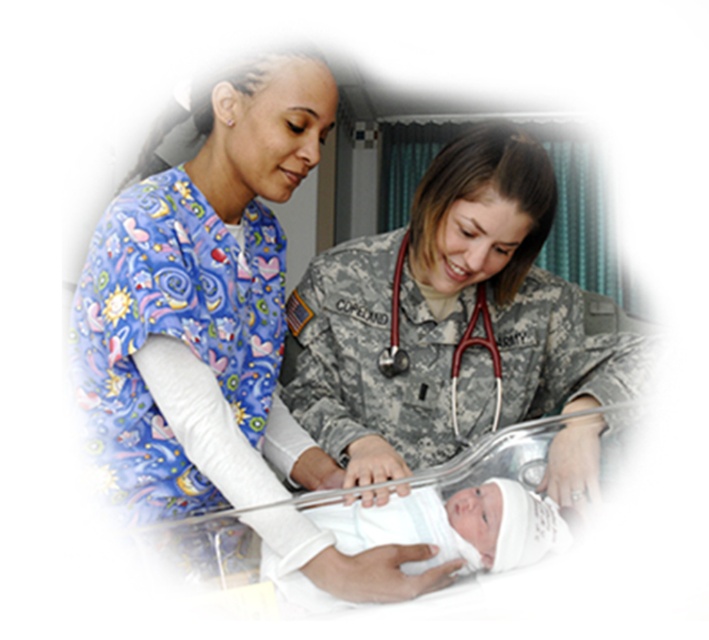
You are a hospital administrator planning to install a new bench in the waiting area. The bench needs to accommodate both the camouflage uniform at center and the printed cotton scrub top at left comfortably. Based on the scene, can you determine if the bench width is sufficient for both individuals to sit side by side?

The camouflage uniform at center might be wider than printed cotton scrub top at left, so the bench width may not be sufficient for both to sit comfortably side by side unless it is designed to accommodate the wider camouflage uniform at center.

You are a hospital administrator planning to install a new coat rack. The rack has two hooks spaced 1 meter apart. You need to hang both the printed cotton scrub top at left and the red rubber stethoscope at center on adjacent hooks. Given their widths, will both items fit comfortably on the rack without overlapping?

The printed cotton scrub top at left is wider than the red rubber stethoscope at center. Since the two hooks are spaced 1 meter apart, and the scrub top is wider, there should be enough space for both items to hang comfortably without overlapping, provided the scrub top does not exceed the 1 meter spacing when hung.

You are a delivery person who needs to place a small package at the point marked as point (447, 317). Based on the scene description, where exactly should you place the package?

The point (447, 317) is on the camouflage uniform at center, so you should place the package on the camouflage uniform at center.